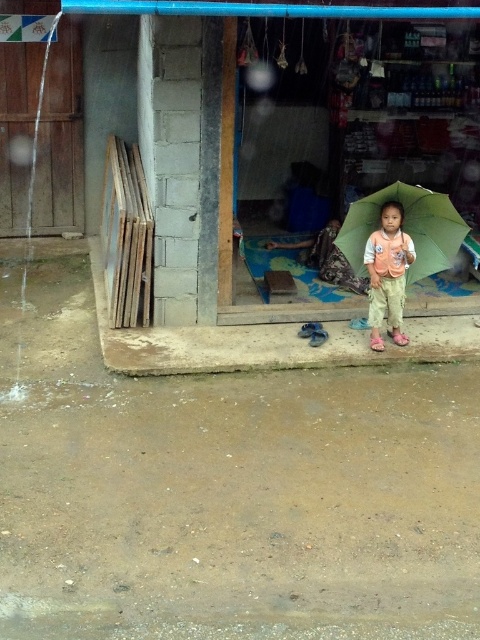
Does green matte umbrella at center have a larger size compared to matte orange vest at center?

Yes.

Who is shorter, green matte umbrella at center or matte orange vest at center?

green matte umbrella at center is shorter.

Between point (447, 208) and point (394, 273), which one is positioned in front?

Point (447, 208) is in front.

You are a GUI agent. You are given a task and a screenshot of the screen. Output one action in this format:
    pyautogui.click(x=<x>, y=<y>)
    Task: Click on the green matte umbrella at center
    
    Given the screenshot: What is the action you would take?
    pyautogui.click(x=407, y=227)